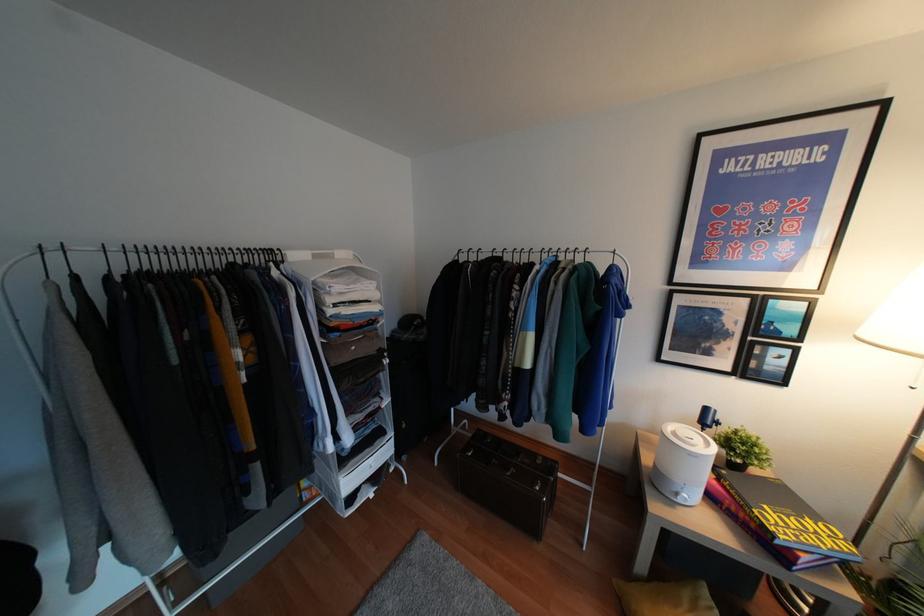
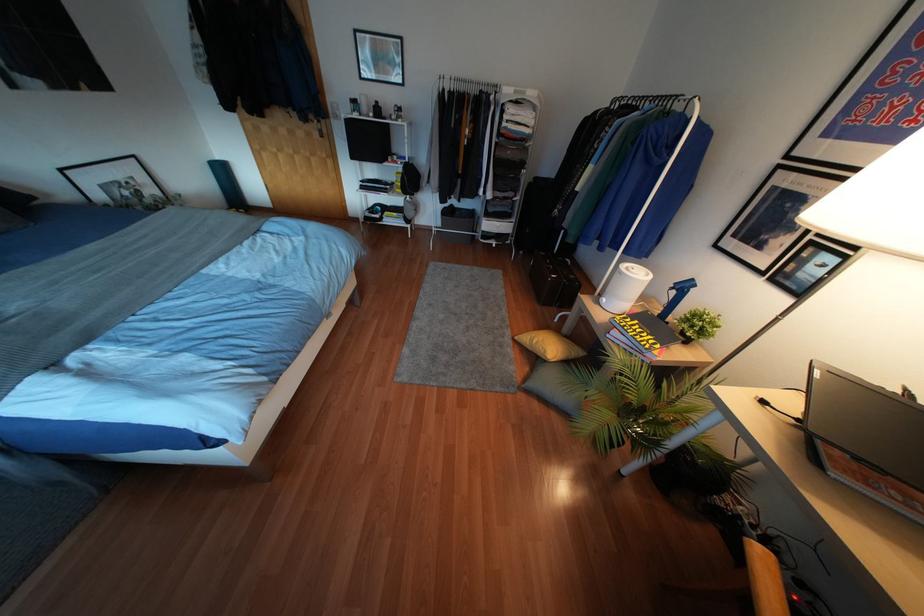
In the second image, find the point that corresponds to point (706, 408) in the first image.

(690, 280)